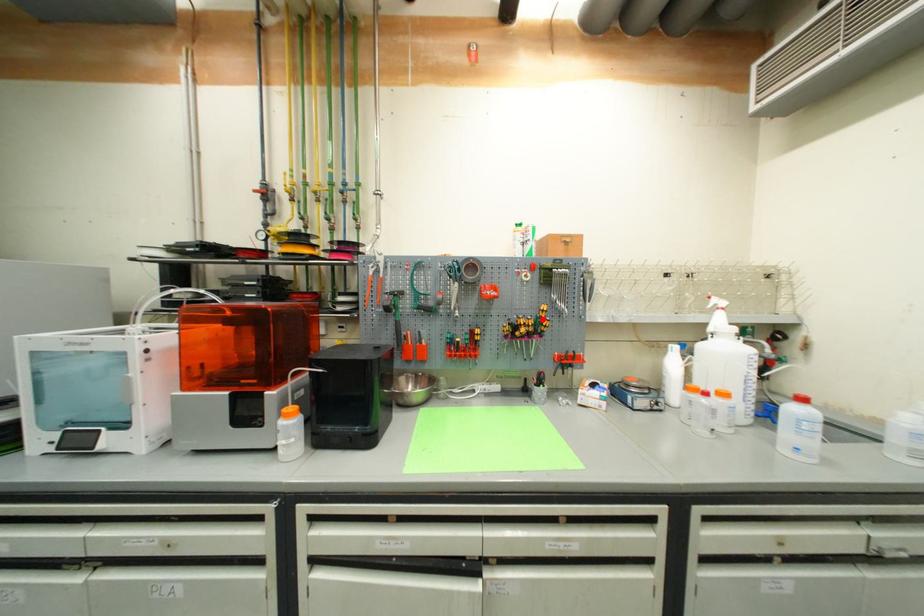
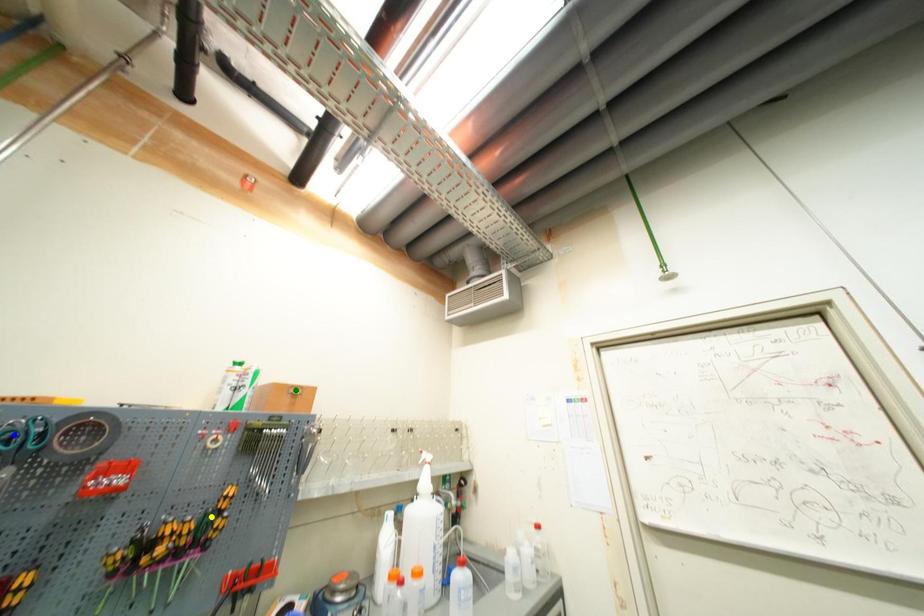
Question: I am providing you with two images of the same scene from different viewpoints. A red point is marked on the first image. You are given multiple points on the second image. Which point in image 2 is actually the same real-world point as the red point in image 1?

Choices:
 (A) green point
 (B) yellow point
 (C) blue point

Answer: (B)